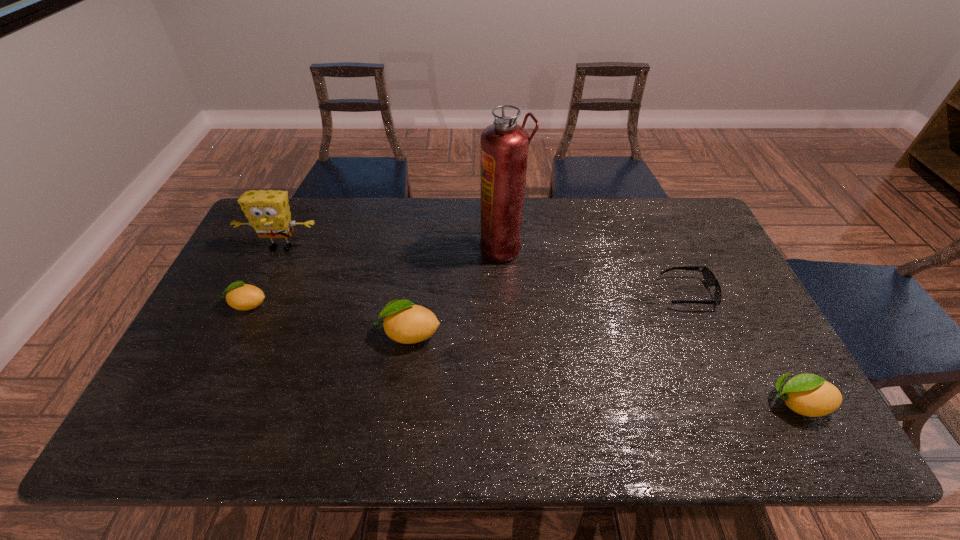
Locate an element on the screen. vacant space that's between the sunglasses and the fifth shortest object is located at coordinates (485, 270).

At what (x,y) coordinates should I click in order to perform the action: click on free space between the nearest lemon and the second nearest lemon. Please return your answer as a coordinate pair (x, y). The height and width of the screenshot is (540, 960). Looking at the image, I should click on (603, 368).

Where is `free spot between the second lemon from right to left and the second tallest object`? The width and height of the screenshot is (960, 540). free spot between the second lemon from right to left and the second tallest object is located at coordinates [x=346, y=291].

In order to click on free point between the second shortest object and the nearest object in this screenshot , I will do `click(522, 354)`.

Find the location of `free space between the nearest lemon and the shortest lemon`. free space between the nearest lemon and the shortest lemon is located at coordinates (522, 354).

At what (x,y) coordinates should I click in order to perform the action: click on free spot between the sponge and the second shortest object. Please return your answer as a coordinate pair (x, y). The width and height of the screenshot is (960, 540). Looking at the image, I should click on (265, 276).

Identify the location of free space that is in between the second tallest object and the rightmost lemon. (540, 325).

This screenshot has height=540, width=960. I want to click on object that ranks as the fifth closest to the fifth farthest object, so click(x=807, y=394).

Identify which object is the fourth nearest to the sponge. Please provide its 2D coordinates. Your answer should be formatted as a tuple, i.e. [(x, y)], where the tuple contains the x and y coordinates of a point satisfying the conditions above.

[(709, 278)]

At what (x,y) coordinates should I click in order to perform the action: click on lemon that is the third closest to the tallest object. Please return your answer as a coordinate pair (x, y). Looking at the image, I should click on 807,394.